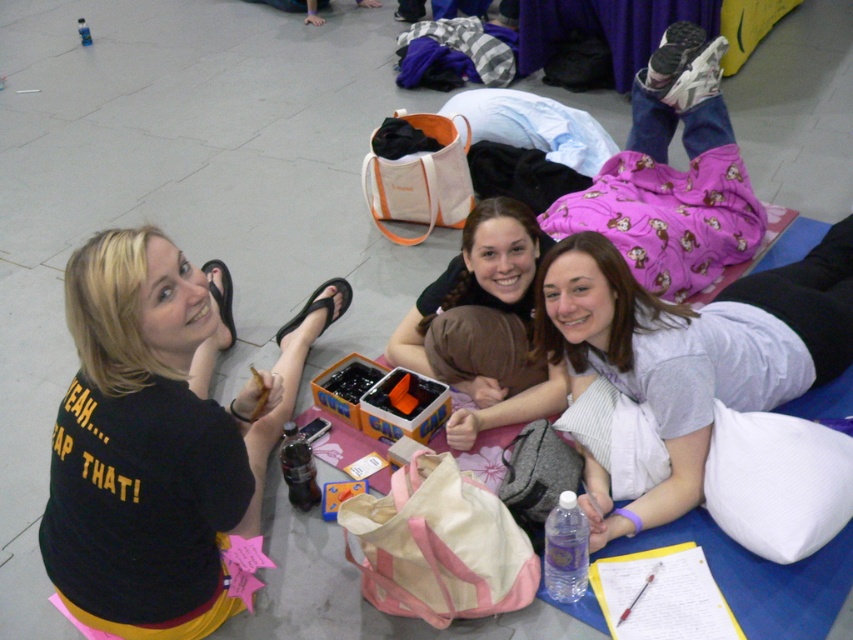
You are designing a layout for a magazine spread and need to place two elements based on their sizes. The black matte shirt at upper left and the matte black hair at center are the focus. Which element should you choose if you need to allocate more space for the larger object?

The black matte shirt at upper left should be allocated more space because its width is larger than the matte black hair at center.

You are taking a photo of the black matte shirt at upper left and the matte black hair at center. Which object is located more to the left in the image?

The black matte shirt at upper left is more to the left than the matte black hair at center.

You are a photographer trying to capture a candid shot of the black matte shirt at upper left and the matte black hair at center. Based on their positions, which object is closer to the camera?

The black matte shirt at upper left is located below matte black hair at center, so the matte black hair at center is closer to the camera because it is positioned above the shirt.